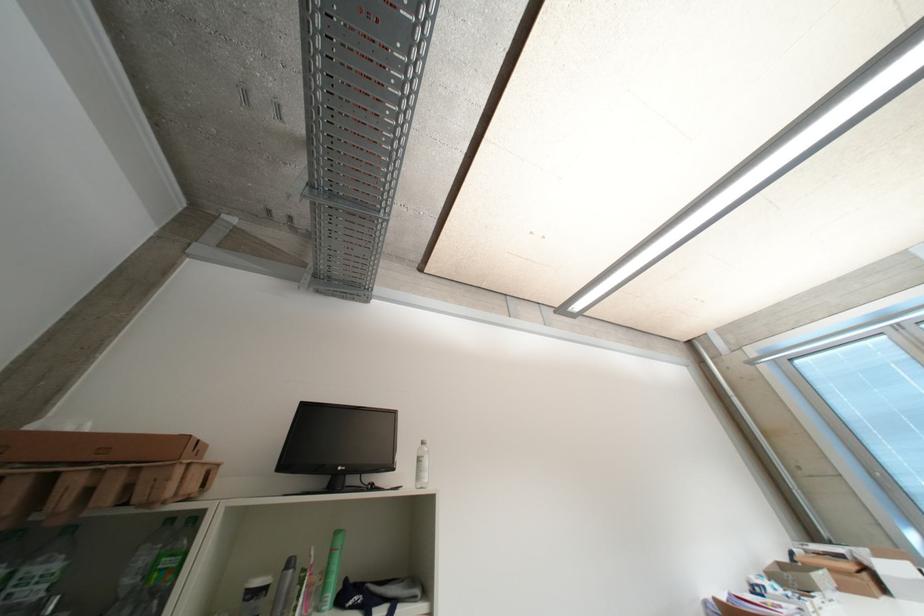
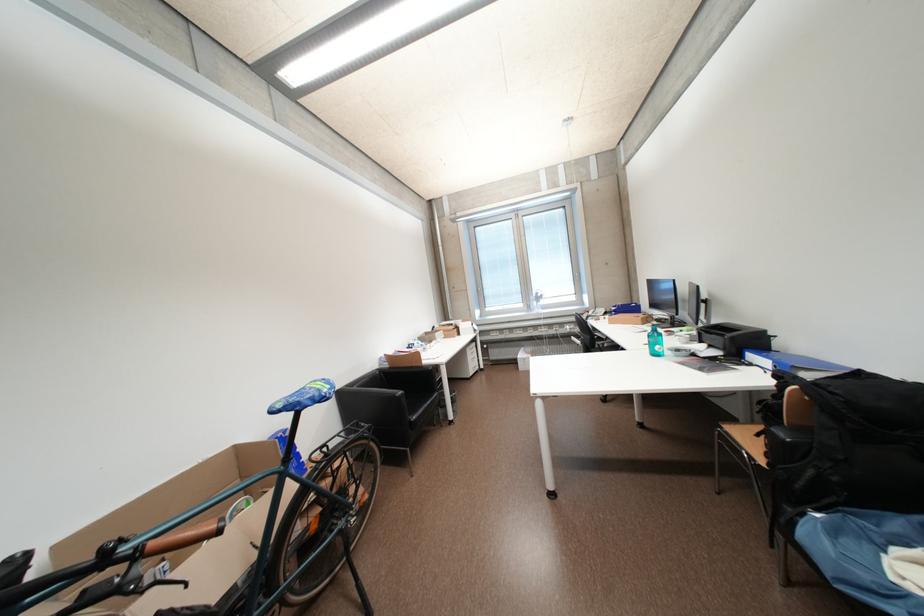
Find the pixel in the second image that matches the point at 799,554 in the first image.

(442, 330)